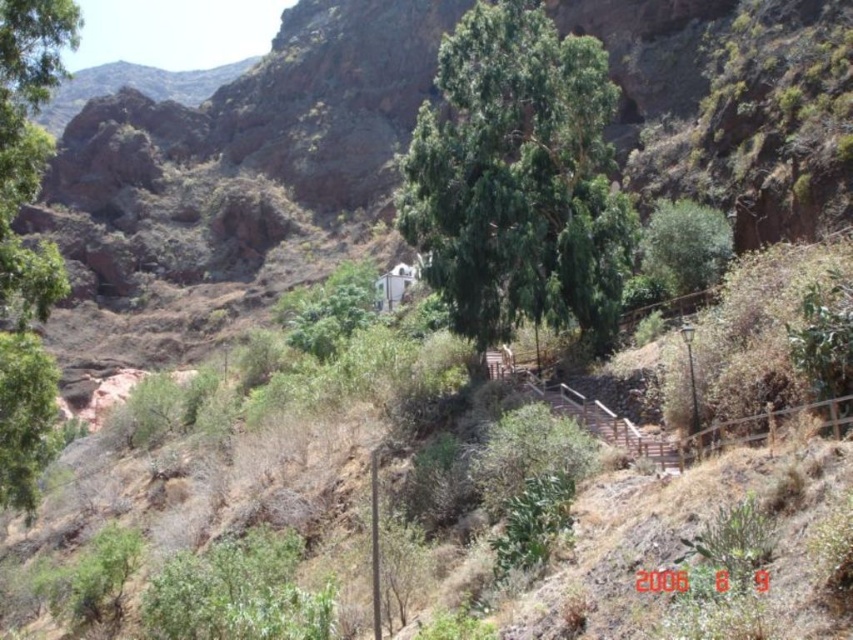
Question: Based on their relative distances, which object is farther from the green leafy tree at left?

Choices:
 (A) green leafy tree at center
 (B) green leafy tree at upper right

Answer: (B)

Question: Can you confirm if green leafy tree at center is positioned to the right of green leafy tree at upper right?

Choices:
 (A) yes
 (B) no

Answer: (B)

Question: Is green leafy tree at center above green leafy tree at upper right?

Choices:
 (A) no
 (B) yes

Answer: (B)

Question: Which point appears closest to the camera in this image?

Choices:
 (A) (473, 308)
 (B) (675, 232)

Answer: (A)

Question: Which point is closer to the camera?

Choices:
 (A) green leafy tree at upper right
 (B) green leafy tree at center

Answer: (B)

Question: Does green leafy tree at center have a larger size compared to green leafy tree at upper right?

Choices:
 (A) no
 (B) yes

Answer: (B)